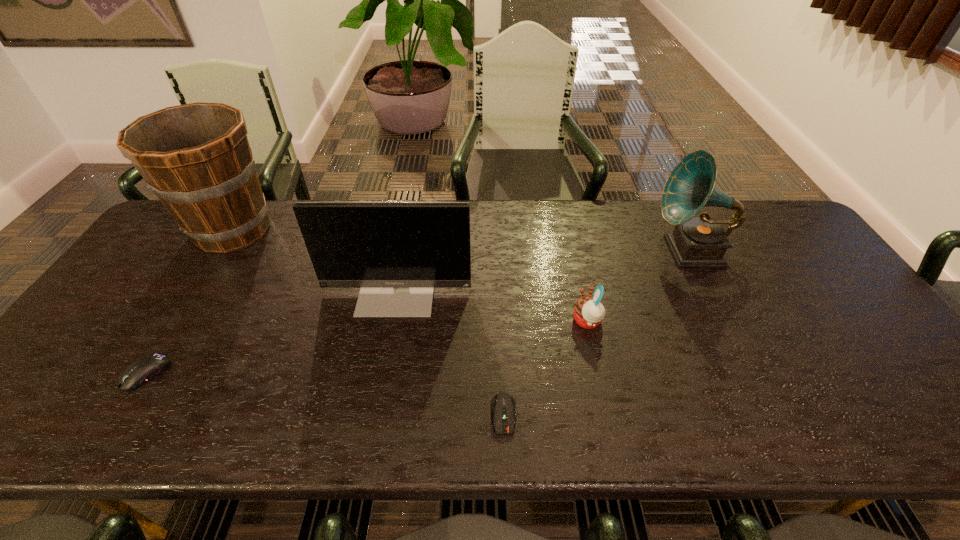
You are a GUI agent. You are given a task and a screenshot of the screen. Output one action in this format:
    pyautogui.click(x=<x>, y=<y>)
    Task: Click on the bucket
    The height and width of the screenshot is (540, 960).
    Given the screenshot: What is the action you would take?
    pos(196,158)

Identify the location of phonograph_record. (700, 241).

Where is `the third object from left to right`? Image resolution: width=960 pixels, height=540 pixels. the third object from left to right is located at coordinates (397, 252).

The height and width of the screenshot is (540, 960). I want to click on the fourth tallest object, so click(x=589, y=311).

Identify the location of the second object from right to left. This screenshot has width=960, height=540. (589, 311).

Where is `the fifth farthest object`? The width and height of the screenshot is (960, 540). the fifth farthest object is located at coordinates (144, 369).

At what (x,y) coordinates should I click in order to perform the action: click on the left computer equipment. Please return your answer as a coordinate pair (x, y). The height and width of the screenshot is (540, 960). Looking at the image, I should click on point(144,369).

This screenshot has height=540, width=960. What are the coordinates of `the right computer equipment` in the screenshot? It's located at (503, 404).

Find the location of a particular element. The image size is (960, 540). the nearer computer equipment is located at coordinates (503, 404).

Locate an element on the screen. vacant space located 0.240m on the right of the bucket is located at coordinates (356, 230).